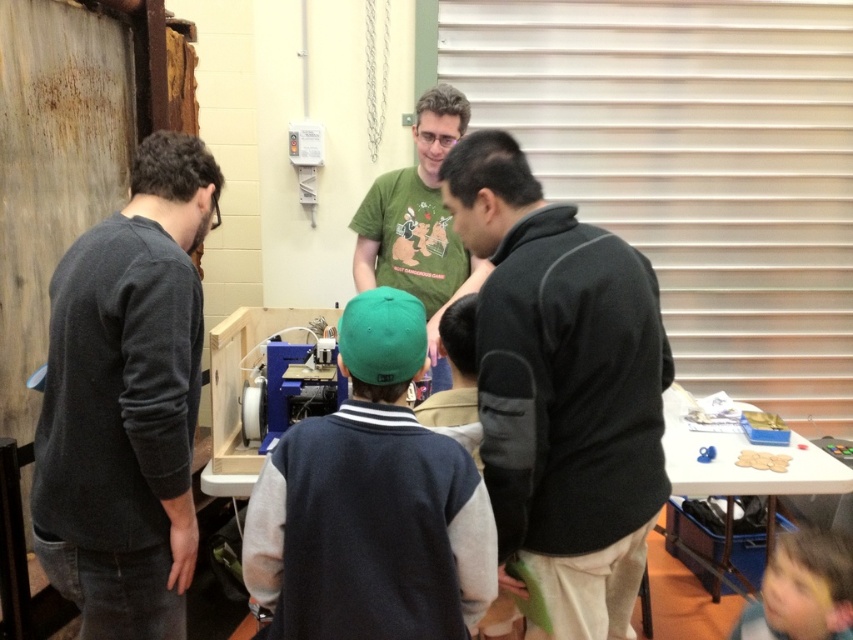
The width and height of the screenshot is (853, 640). Find the location of `dark gray sweater at left`. dark gray sweater at left is located at coordinates (126, 401).

Does dark gray sweater at left have a lesser height compared to green t-shirt at center?

No.

Who is more forward, (138,250) or (428,205)?

Point (138,250) is more forward.

You are a GUI agent. You are given a task and a screenshot of the screen. Output one action in this format:
    pyautogui.click(x=<x>, y=<y>)
    Task: Click on the dark gray sweater at left
    The image size is (853, 640).
    Given the screenshot: What is the action you would take?
    pyautogui.click(x=126, y=401)

I want to click on dark gray fleece jacket at center, so click(561, 387).

Which is in front, point (592, 561) or point (47, 573)?

Point (592, 561) is more forward.

The width and height of the screenshot is (853, 640). What do you see at coordinates (561, 387) in the screenshot?
I see `dark gray fleece jacket at center` at bounding box center [561, 387].

Where is `dark gray fleece jacket at center`? dark gray fleece jacket at center is located at coordinates (561, 387).

Is point (363, 349) closer to viewer compared to point (728, 568)?

Yes.

Is green fabric cap at center to the right of white plastic table at lower right from the viewer's perspective?

In fact, green fabric cap at center is to the left of white plastic table at lower right.

Image resolution: width=853 pixels, height=640 pixels. Describe the element at coordinates (370, 502) in the screenshot. I see `green fabric cap at center` at that location.

The image size is (853, 640). In order to click on green fabric cap at center in this screenshot , I will do `click(370, 502)`.